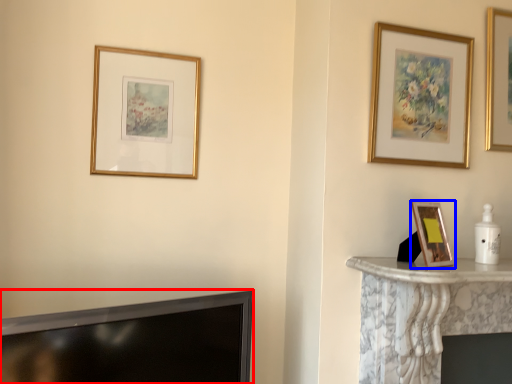
Question: Which point is closer to the camera, television (highlighted by a red box) or picture frame (highlighted by a blue box)?

Choices:
 (A) television
 (B) picture frame

Answer: (A)